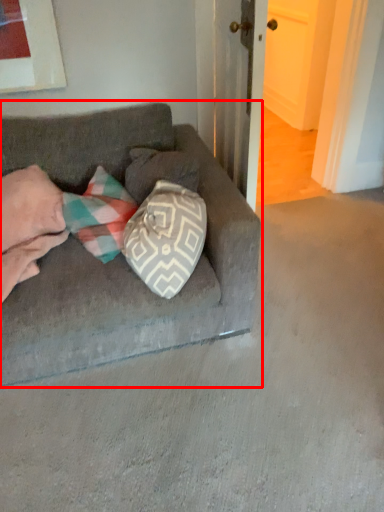
Question: From the image's perspective, what is the correct spatial relationship of studio couch (annotated by the red box) in relation to couple?

Choices:
 (A) above
 (B) below

Answer: (B)